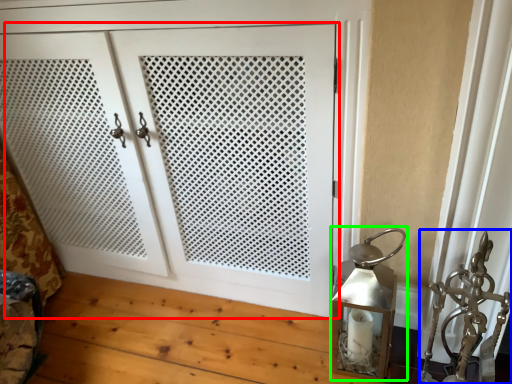
Question: Based on their relative distances, which object is farther from door (highlighted by a red box)? Choose from sculpture (highlighted by a blue box) and table lamp (highlighted by a green box).

Choices:
 (A) sculpture
 (B) table lamp

Answer: (A)